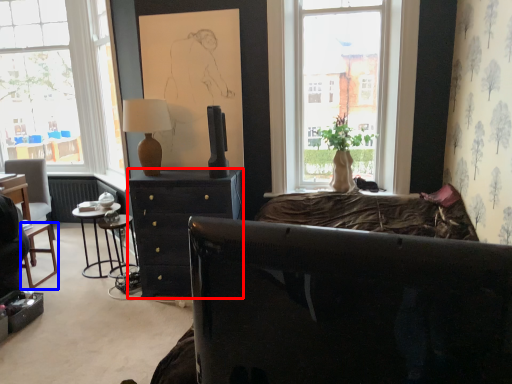
Question: Which point is closer to the camera, desk (highlighted by a red box) or bar stool (highlighted by a blue box)?

Choices:
 (A) desk
 (B) bar stool

Answer: (A)